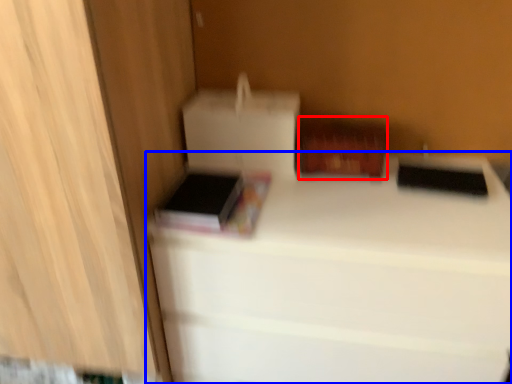
Question: Which of the following is the closest to the observer, cardboard box (highlighted by a red box) or furniture (highlighted by a blue box)?

Choices:
 (A) cardboard box
 (B) furniture

Answer: (B)